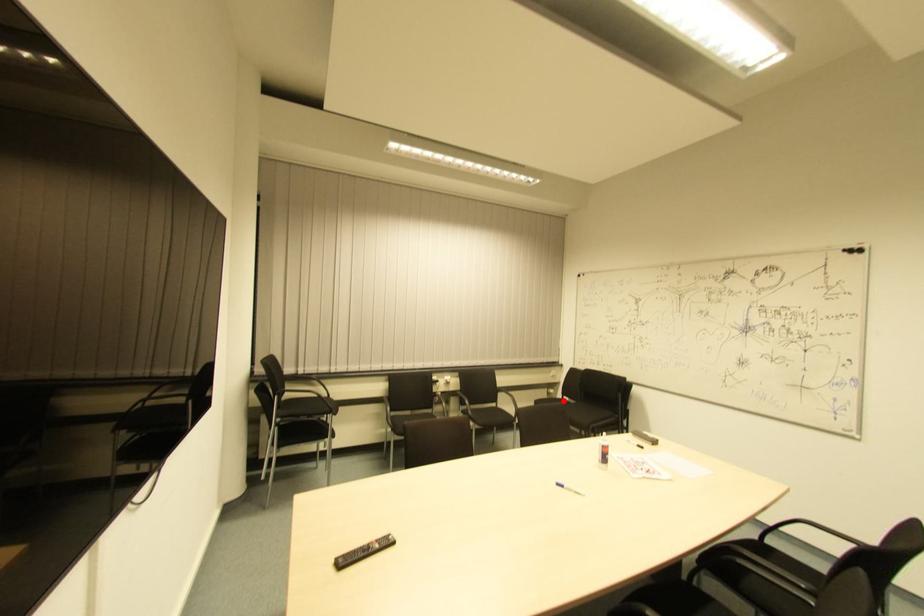
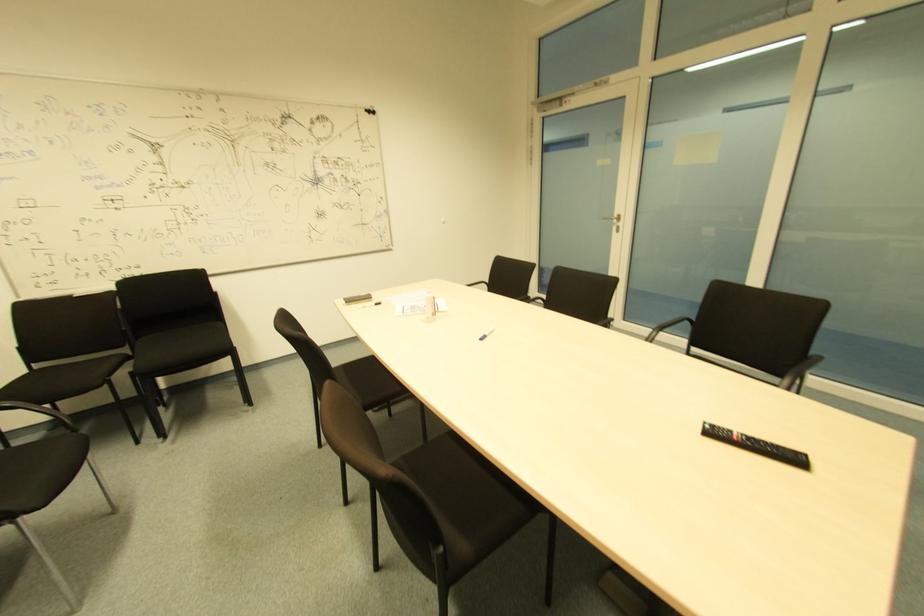
Question: I am providing you with two images of the same scene from different viewpoints. A red point is shown in image1. For the corresponding object point in image2, is it positioned nearer or farther from the camera?

Choices:
 (A) Nearer
 (B) Farther

Answer: (B)